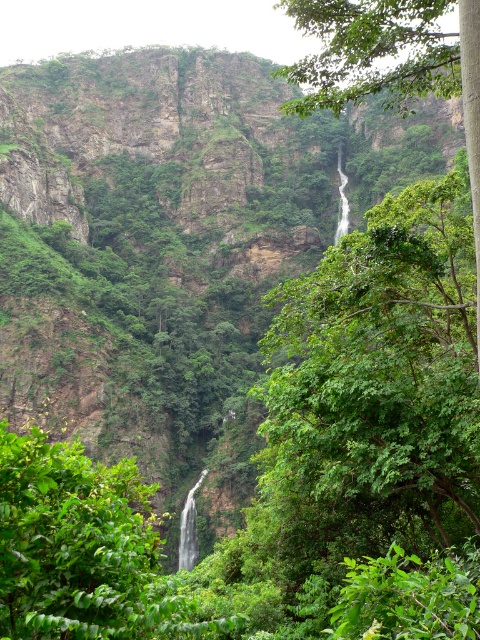
You are a hiker who wants to take a photo of the white smooth waterfall at center. You have a camera with a standard lens that can capture objects up to 10 meters wide. The green leafy tree at upper center is blocking part of your view. Based on their sizes, can you determine if the tree will completely block the waterfall in your photo?

The green leafy tree at upper center is larger than the white smooth waterfall at center. Since the tree is blocking part of the view and is bigger, it might completely block the waterfall depending on their positions. However, without knowing the exact distance and angle, it is uncertain. But since the tree is larger, there is a higher chance it could obstruct the entire waterfall.

You are standing at the base of the cliff looking up at the scene. Which object is positioned to the right when comparing the green leafy tree at upper center and the white smooth waterfall at center?

The green leafy tree at upper center is positioned to the right of the white smooth waterfall at center.

You are a hiker trying to cross the white smooth waterfall at center. You need to know if the green leafy tree at upper center is wider than the waterfall. Can you determine this?

The green leafy tree at upper center might be wider than the white smooth waterfall at center.